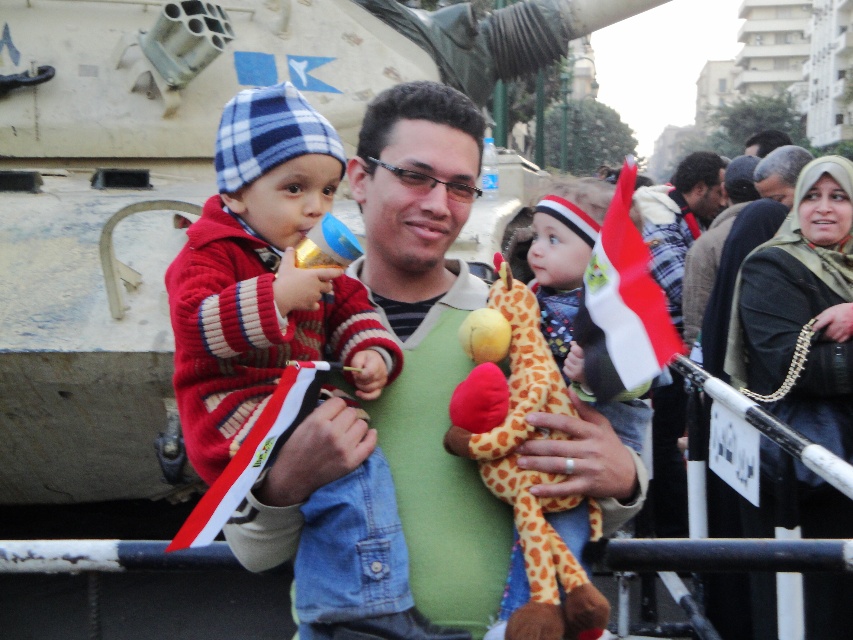
You are a photographer taking a picture of the scene. You want to focus on the red and white striped sweater at center. What are the coordinates where you should aim your camera?

The coordinates to focus on the red and white striped sweater at center are point (263,276).

From the picture: You are a photographer trying to capture a photo of the red and white striped sweater at center and the soft plush giraffe at center. If you want to ensure both objects are in focus, which one should you focus on first?

The red and white striped sweater at center is larger in width than the soft plush giraffe at center, so you should focus on the red and white striped sweater at center first to ensure both are in focus.

You are organizing a photo shoot and need to ensure that the red and white striped sweater at center and the soft plush giraffe at center are visible in the same frame. Given that your camera has a minimum focus distance of 25 inches, will you be able to capture both items clearly in the photo?

The red and white striped sweater at center and the soft plush giraffe at center are 28.15 inches apart. Since the minimum focus distance is 25 inches, the camera can focus on both items as they are within the required distance.